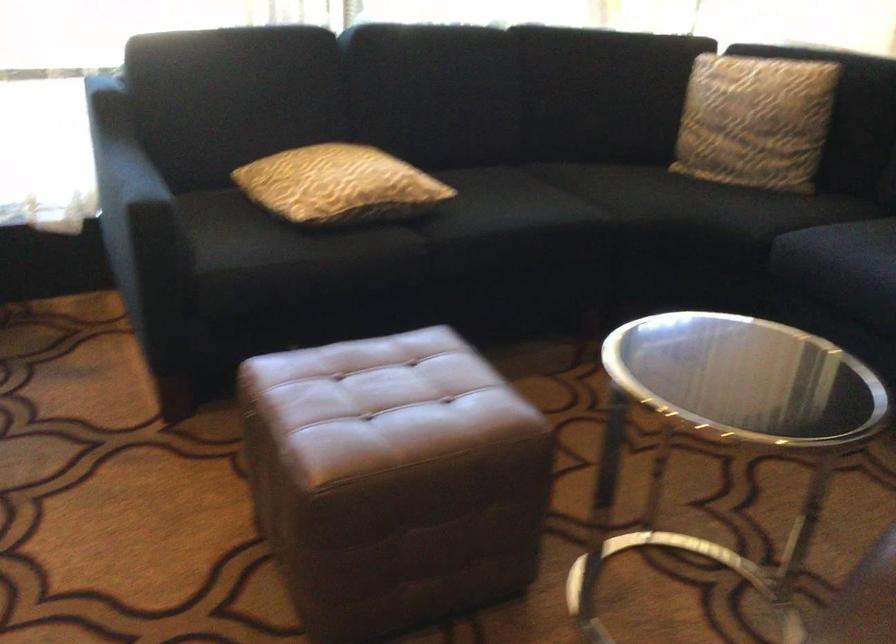
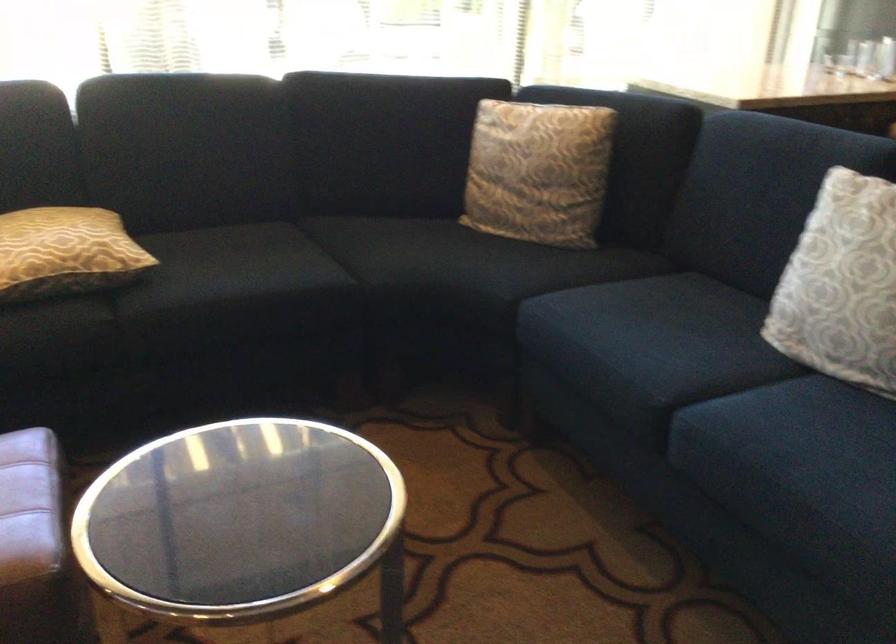
Question: The first image is from the beginning of the video and the second image is from the end. How did the camera likely rotate when shooting the video?

Choices:
 (A) Left
 (B) Right
 (C) Up
 (D) Down

Answer: (C)